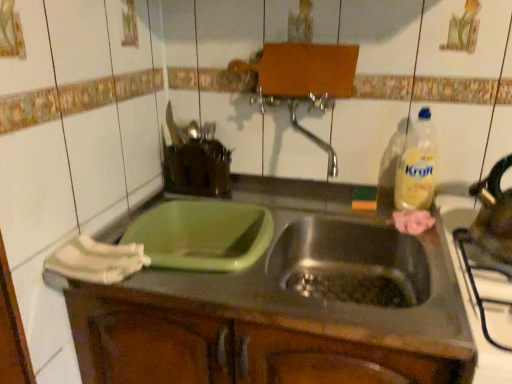
Where is `vacant space situated on the left part of yellow plastic bottle at right`? vacant space situated on the left part of yellow plastic bottle at right is located at coordinates (352, 215).